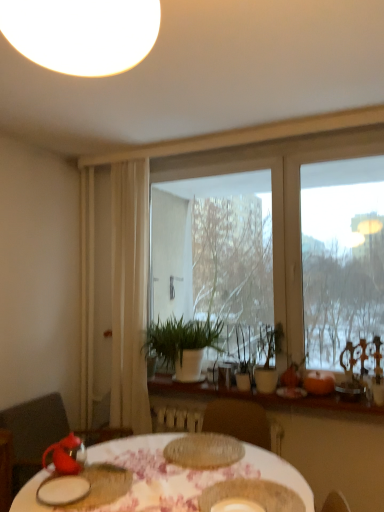
Identify the location of unoccupied space behind matte red teapot at lower left, positioned as the first tableware in left-to-right order. This screenshot has height=512, width=384. (101, 456).